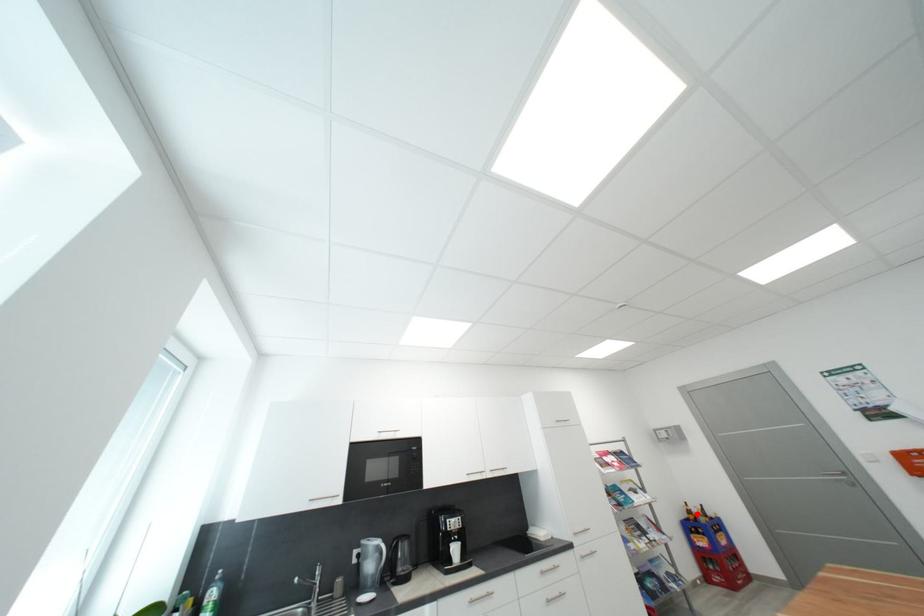
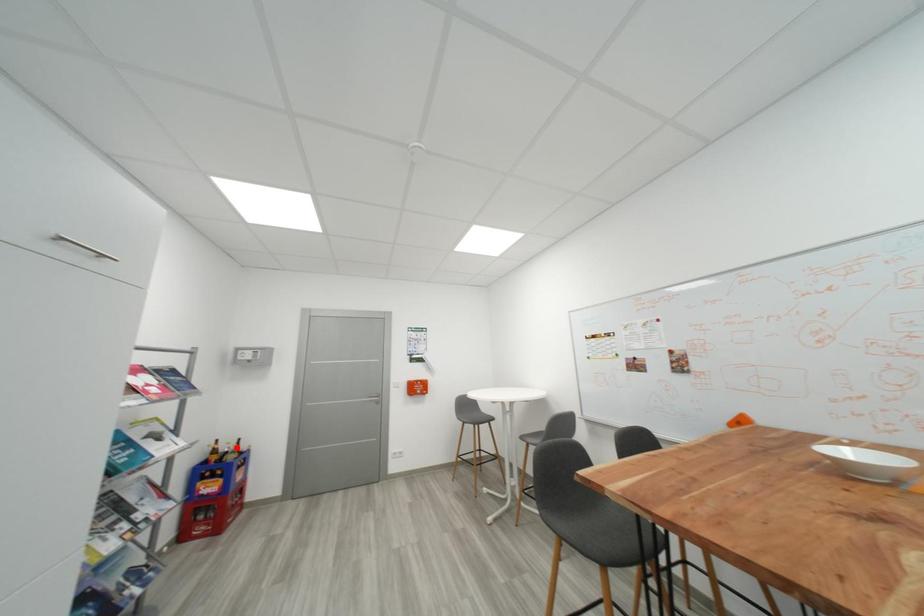
I am providing you with two images of the same scene from different viewpoints. A red point is marked on the first image and another point is marked on the second image. Is the red point in image1 aligned with the point shown in image2?

No